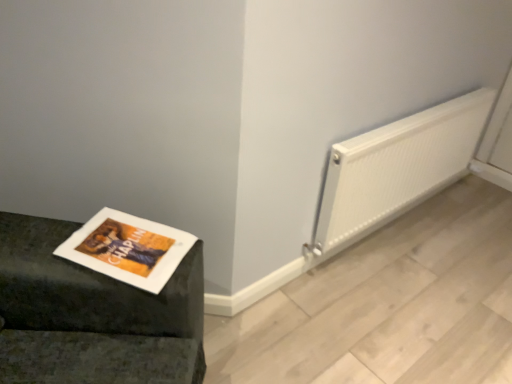
Question: Is matte paper magazine at lower left a part of white ribbed radiator at right?

Choices:
 (A) yes
 (B) no

Answer: (B)

Question: Considering the relative sizes of white ribbed radiator at right and matte paper magazine at lower left in the image provided, is white ribbed radiator at right smaller than matte paper magazine at lower left?

Choices:
 (A) no
 (B) yes

Answer: (A)

Question: Is white ribbed radiator at right directly adjacent to matte paper magazine at lower left?

Choices:
 (A) no
 (B) yes

Answer: (A)

Question: Considering the relative sizes of white ribbed radiator at right and matte paper magazine at lower left in the image provided, is white ribbed radiator at right bigger than matte paper magazine at lower left?

Choices:
 (A) yes
 (B) no

Answer: (A)

Question: From a real-world perspective, does white ribbed radiator at right stand above matte paper magazine at lower left?

Choices:
 (A) yes
 (B) no

Answer: (B)

Question: Is white ribbed radiator at right oriented towards matte paper magazine at lower left?

Choices:
 (A) yes
 (B) no

Answer: (B)

Question: Is matte paper magazine at lower left oriented towards white ribbed radiator at right?

Choices:
 (A) no
 (B) yes

Answer: (A)

Question: Considering the relative sizes of matte paper magazine at lower left and white ribbed radiator at right in the image provided, is matte paper magazine at lower left shorter than white ribbed radiator at right?

Choices:
 (A) yes
 (B) no

Answer: (A)

Question: From a real-world perspective, is matte paper magazine at lower left under white ribbed radiator at right?

Choices:
 (A) yes
 (B) no

Answer: (B)

Question: Is matte paper magazine at lower left to the right of white ribbed radiator at right from the viewer's perspective?

Choices:
 (A) no
 (B) yes

Answer: (A)

Question: From the image's perspective, does matte paper magazine at lower left appear lower than white ribbed radiator at right?

Choices:
 (A) yes
 (B) no

Answer: (A)

Question: Is matte paper magazine at lower left closer to camera compared to white ribbed radiator at right?

Choices:
 (A) no
 (B) yes

Answer: (B)

Question: Is point (414, 168) closer or farther from the camera than point (78, 230)?

Choices:
 (A) farther
 (B) closer

Answer: (A)